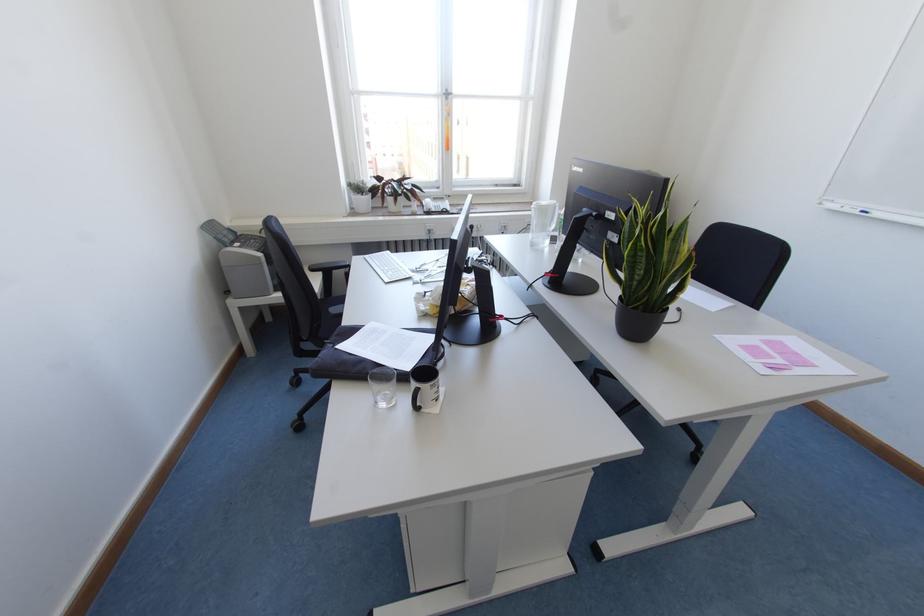
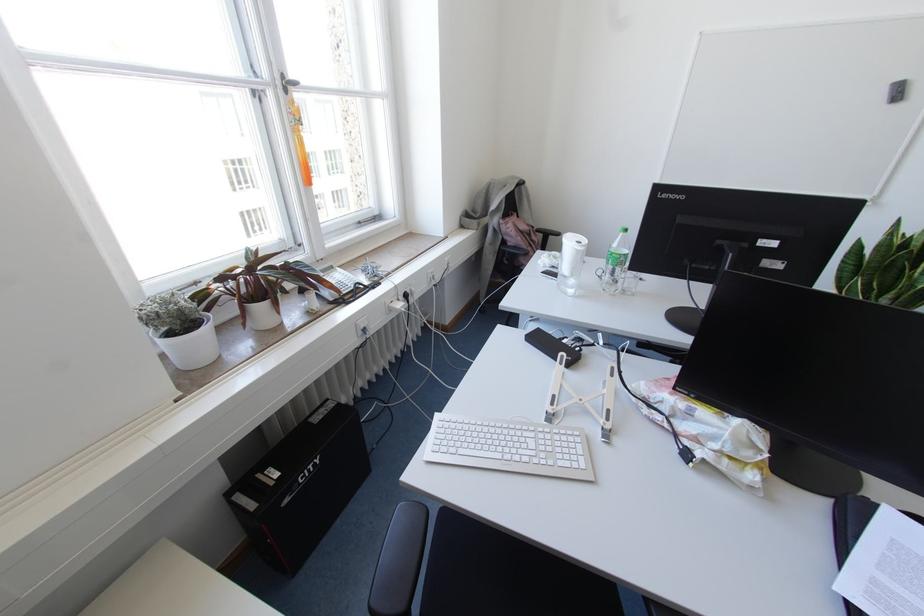
Where in the second image is the point corresponding to (395,199) from the first image?

(274, 302)